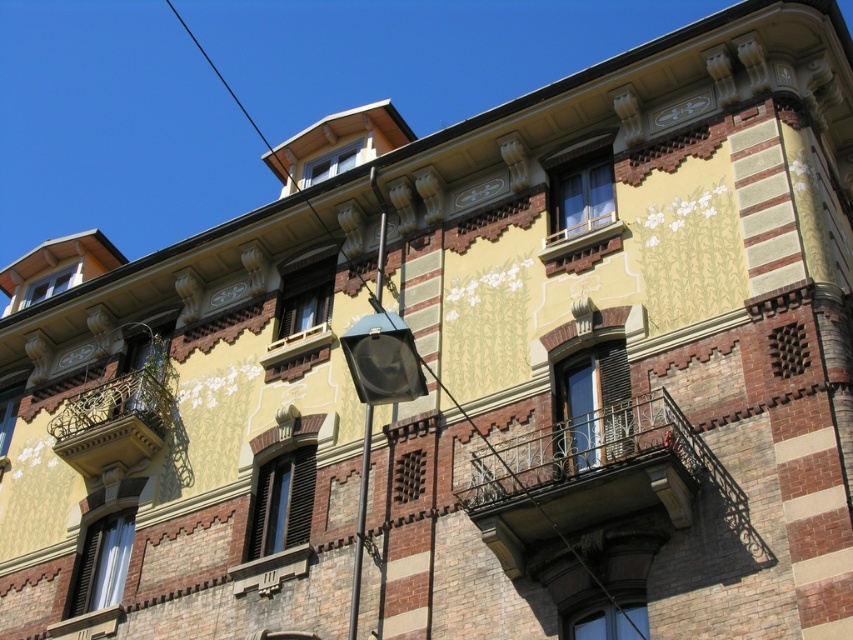
Question: Which point is farther to the camera?

Choices:
 (A) matte glass window at upper center
 (B) brown wooden balcony at center
 (C) matte yellow window at upper center

Answer: (A)

Question: Observing the image, what is the correct spatial positioning of iron/brass balcony at center in reference to matte brown shutters at center?

Choices:
 (A) below
 (B) above

Answer: (B)

Question: Can you confirm if matte yellow window at upper center is positioned below brown wooden balcony at center?

Choices:
 (A) yes
 (B) no

Answer: (B)

Question: Estimate the real-world distances between objects in this image. Which object is farther from the matte yellow window at upper left?

Choices:
 (A) matte glass window at upper center
 (B) matte yellow window at upper center
 (C) iron/brass balcony at center
 (D) matte brown wooden window at center

Answer: (C)

Question: Among these points, which one is farthest from the camera?

Choices:
 (A) (85, 570)
 (B) (282, 296)
 (C) (328, 296)

Answer: (B)

Question: Is matte brown shutters at center positioned at the back of matte yellow window at upper left?

Choices:
 (A) no
 (B) yes

Answer: (A)